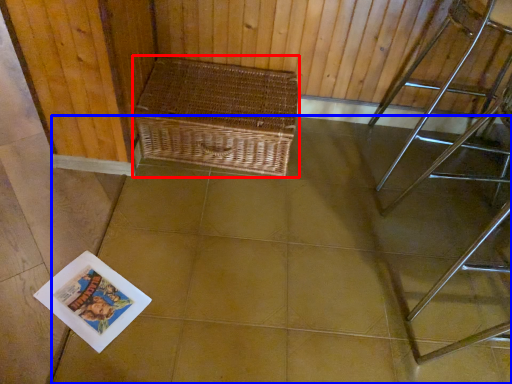
Question: Which object is further to the camera taking this photo, picnic basket (highlighted by a red box) or square (highlighted by a blue box)?

Choices:
 (A) picnic basket
 (B) square

Answer: (A)